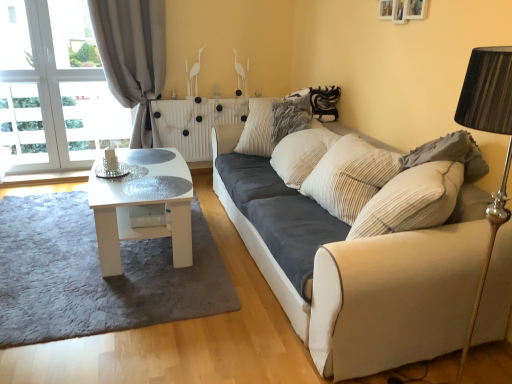
Question: Is gray shaggy rug at lower left turned away from white marble radiator at center?

Choices:
 (A) no
 (B) yes

Answer: (A)

Question: Considering the relative sizes of gray shaggy rug at lower left and white marble radiator at center in the image provided, is gray shaggy rug at lower left bigger than white marble radiator at center?

Choices:
 (A) no
 (B) yes

Answer: (B)

Question: Does gray shaggy rug at lower left have a smaller size compared to white marble radiator at center?

Choices:
 (A) yes
 (B) no

Answer: (B)

Question: From the image's perspective, is gray shaggy rug at lower left on white marble radiator at center?

Choices:
 (A) yes
 (B) no

Answer: (B)

Question: Is gray shaggy rug at lower left to the right of white marble radiator at center from the viewer's perspective?

Choices:
 (A) no
 (B) yes

Answer: (A)

Question: Can you see gray shaggy rug at lower left touching white marble radiator at center?

Choices:
 (A) yes
 (B) no

Answer: (B)

Question: Is transparent glass table at center closer to camera compared to gray textured pillow at right, the first pillow in the right-to-left sequence?

Choices:
 (A) yes
 (B) no

Answer: (B)

Question: Would you say gray textured pillow at right, the second pillow viewed from the left, is part of transparent glass table at center's contents?

Choices:
 (A) yes
 (B) no

Answer: (B)

Question: Is transparent glass table at center turned away from gray textured pillow at right, the second pillow viewed from the left?

Choices:
 (A) no
 (B) yes

Answer: (A)

Question: Is transparent glass table at center next to gray textured pillow at right, which is counted as the 1th pillow, starting from the front?

Choices:
 (A) no
 (B) yes

Answer: (A)

Question: Does transparent glass table at center have a greater width compared to gray textured pillow at right, the first pillow in the right-to-left sequence?

Choices:
 (A) yes
 (B) no

Answer: (A)

Question: Is transparent glass table at center shorter than gray textured pillow at right, the second pillow when ordered from back to front?

Choices:
 (A) yes
 (B) no

Answer: (A)

Question: From a real-world perspective, is gray textured pillow at right, which is counted as the 1th pillow, starting from the front, over white glossy coffee table at center?

Choices:
 (A) no
 (B) yes

Answer: (B)